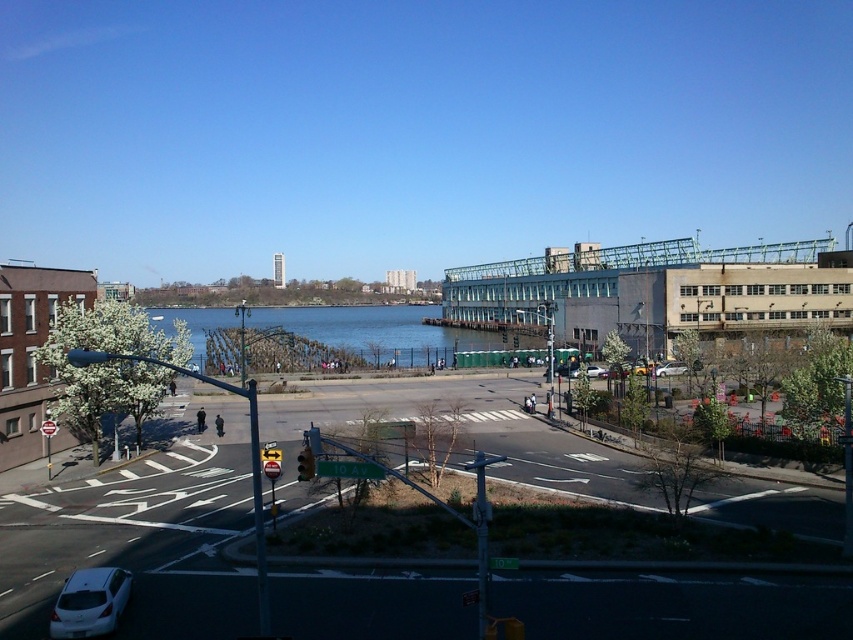
Can you confirm if metallic traffic light at center is smaller than metallic silver sedan at center?

Incorrect, metallic traffic light at center is not smaller in size than metallic silver sedan at center.

Describe the element at coordinates (305, 465) in the screenshot. Image resolution: width=853 pixels, height=640 pixels. I see `metallic traffic light at center` at that location.

Where is `metallic traffic light at center`? metallic traffic light at center is located at coordinates (305, 465).

At what (x,y) coordinates should I click in order to perform the action: click on metallic traffic light at center. Please return your answer as a coordinate pair (x, y). The height and width of the screenshot is (640, 853). Looking at the image, I should click on (305, 465).

Does metallic traffic light at center have a greater height compared to matte silver sedan at center?

Yes.

Does point (312, 460) come closer to viewer compared to point (599, 376)?

Yes, it is.

Is point (299, 461) in front of point (596, 372)?

Yes, it is.

Identify the location of metallic traffic light at center. (305, 465).

Can you confirm if silver metallic sedan at center-right is positioned below matte silver sedan at center?

No, silver metallic sedan at center-right is not below matte silver sedan at center.

Can you confirm if silver metallic sedan at center-right is positioned to the right of matte silver sedan at center?

Correct, you'll find silver metallic sedan at center-right to the right of matte silver sedan at center.

Find the location of a particular element. silver metallic sedan at center-right is located at coordinates (671, 369).